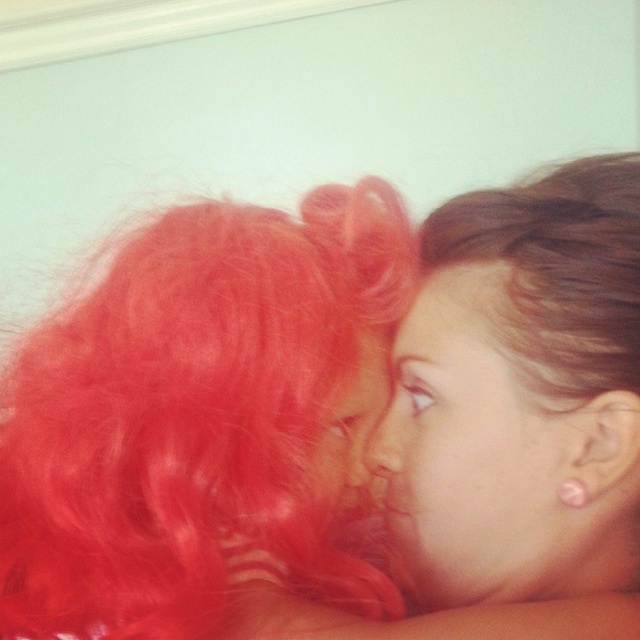
Question: Which point is closer to the camera taking this photo?

Choices:
 (A) (196, 227)
 (B) (365, 470)

Answer: (A)

Question: Is bright red hair at center below smooth skin face at center?

Choices:
 (A) yes
 (B) no

Answer: (B)

Question: Can you confirm if bright red hair at center is positioned above smooth skin face at center?

Choices:
 (A) yes
 (B) no

Answer: (A)

Question: Which object appears closest to the camera in this image?

Choices:
 (A) matte red hair at center
 (B) bright red hair at center

Answer: (B)

Question: Does bright red hair at center appear under matte red hair at center?

Choices:
 (A) yes
 (B) no

Answer: (B)

Question: Which of the following is the closest to the observer?

Choices:
 (A) (168, 426)
 (B) (532, 515)
 (C) (326, 465)

Answer: (A)